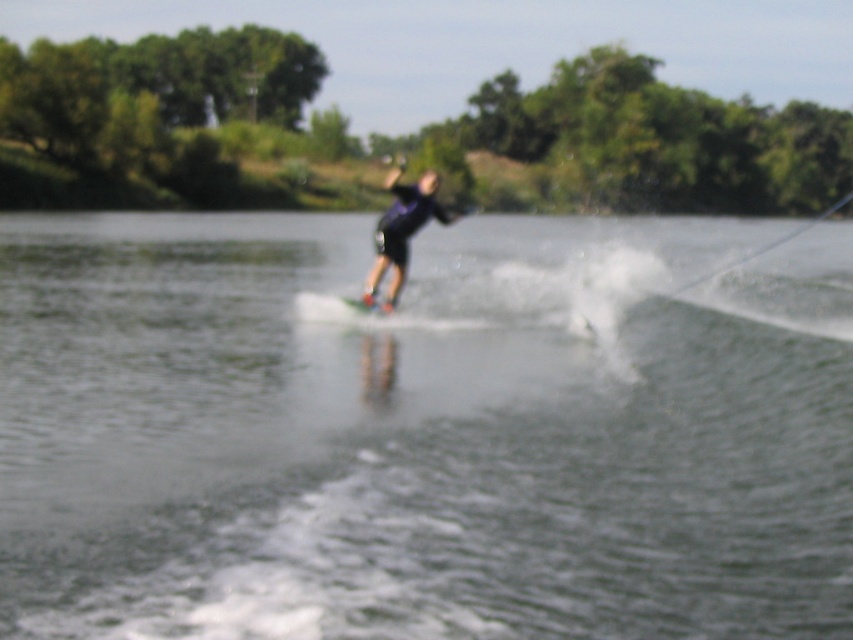
Question: From the image, what is the correct spatial relationship of clear water at center in relation to dark blue fabric at center?

Choices:
 (A) below
 (B) above

Answer: (A)

Question: Is clear water at center above dark blue fabric at center?

Choices:
 (A) no
 (B) yes

Answer: (A)

Question: Does clear water at center lie behind white matte water ski at center?

Choices:
 (A) yes
 (B) no

Answer: (B)

Question: Which point is farther from the camera taking this photo?

Choices:
 (A) (537, 483)
 (B) (430, 186)
 (C) (339, 298)

Answer: (C)

Question: Which object is positioned closest to the dark blue fabric at center?

Choices:
 (A) clear water at center
 (B) white matte water ski at center

Answer: (B)

Question: Which point is farther to the camera?

Choices:
 (A) clear water at center
 (B) dark blue fabric at center
 (C) white matte water ski at center

Answer: (C)